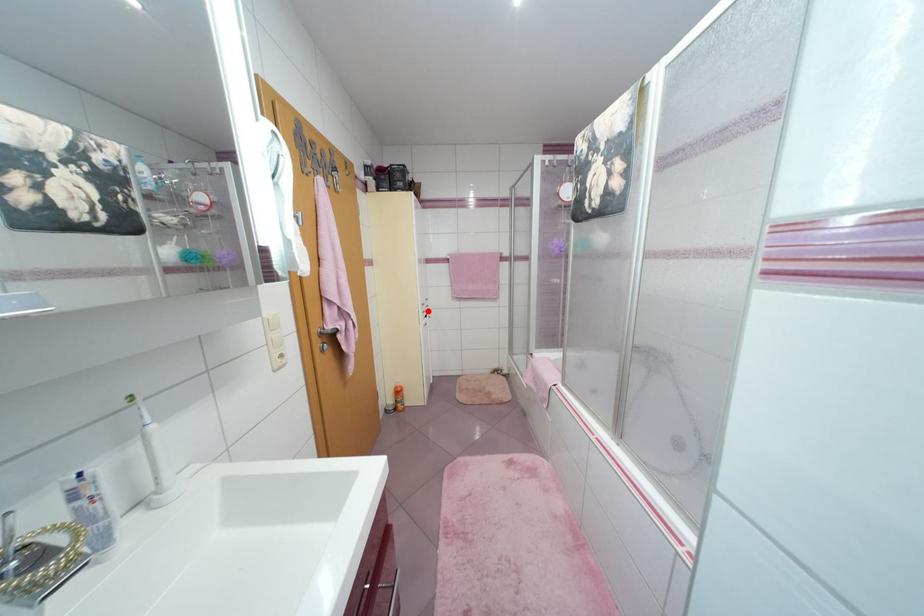
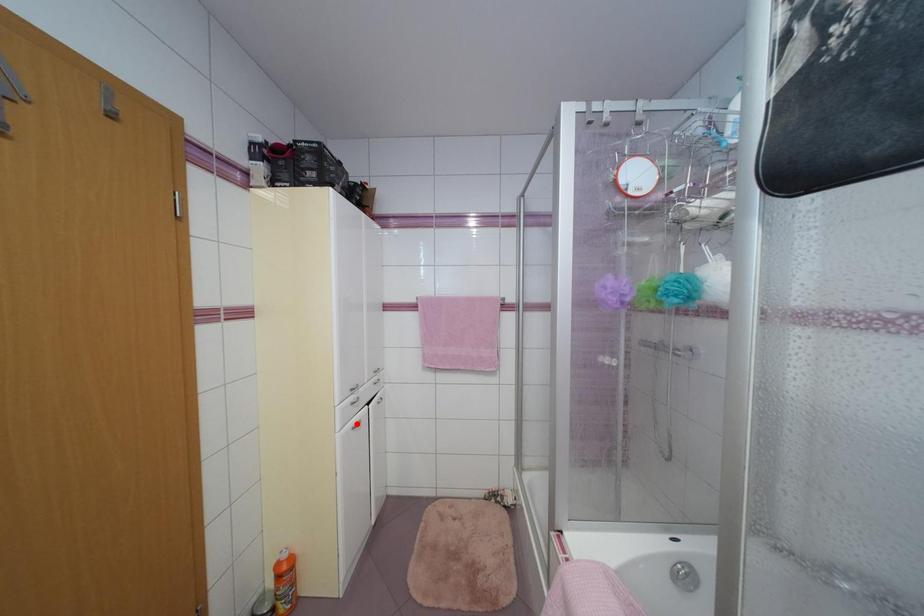
I am providing you with two images of the same scene from different viewpoints. A red point is marked on the first image and another point is marked on the second image. Is the red point in image1 aligned with the point shown in image2?

No